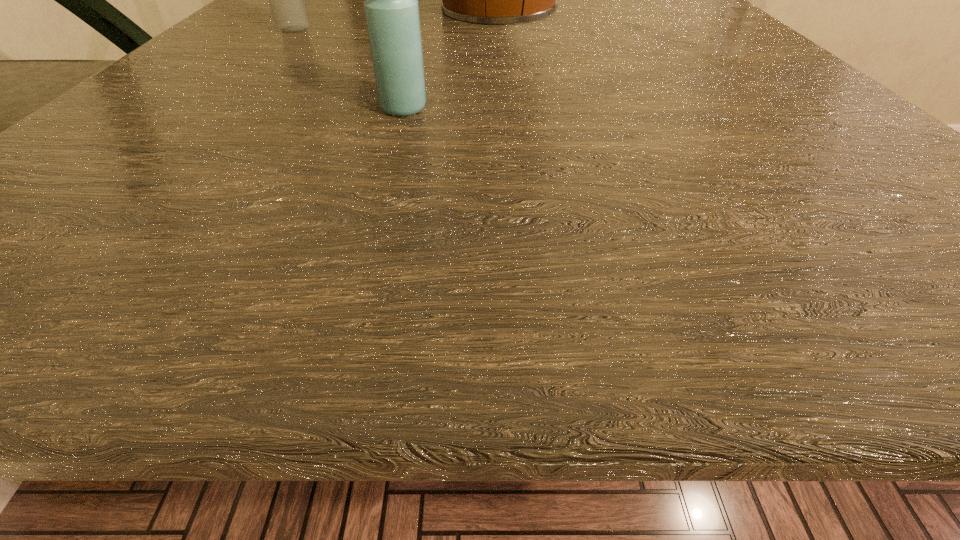
Where is `the farthest water bottle`? This screenshot has height=540, width=960. the farthest water bottle is located at coordinates (286, 0).

Identify the location of the leftmost water bottle. (286, 0).

Locate an element on the screen. The width and height of the screenshot is (960, 540). the second nearest object is located at coordinates (747, 0).

Identify the location of the rightmost object. (747, 0).

The width and height of the screenshot is (960, 540). Find the location of `the second water bottle from left to right`. the second water bottle from left to right is located at coordinates (391, 7).

Image resolution: width=960 pixels, height=540 pixels. What are the coordinates of `the nearest water bottle` in the screenshot? It's located at (391, 7).

This screenshot has width=960, height=540. In order to click on vacant space located 0.390m on the front of the tallest water bottle in this screenshot , I will do `click(160, 168)`.

Image resolution: width=960 pixels, height=540 pixels. What are the coordinates of `blank space located 0.140m on the front of the second farthest water bottle` in the screenshot? It's located at (784, 110).

At what (x,y) coordinates should I click in order to perform the action: click on vacant space situated 0.120m on the back of the second water bottle from right to left. Please return your answer as a coordinate pair (x, y). The image size is (960, 540). Looking at the image, I should click on (417, 62).

I want to click on object that is at the left edge, so click(x=286, y=0).